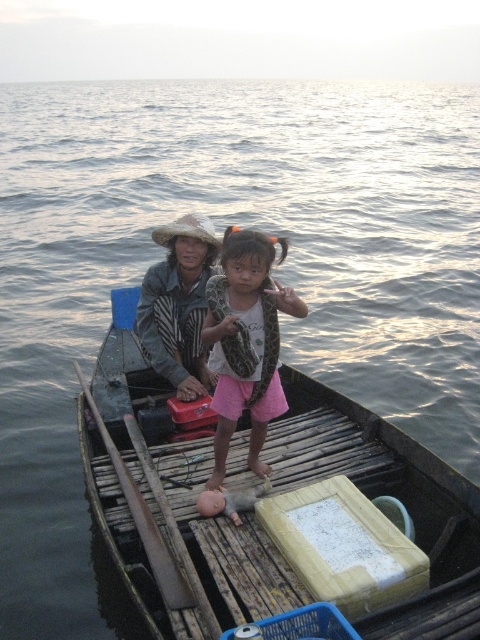
You are a photographer on a boat and need to take a photo of the pink fabric child at center and the brown wood paddle at center. Which object should you zoom in on to capture more details without moving the camera?

The pink fabric child at center has a smaller size compared to the brown wood paddle at center, so you should zoom in on the pink fabric child at center to capture more details.